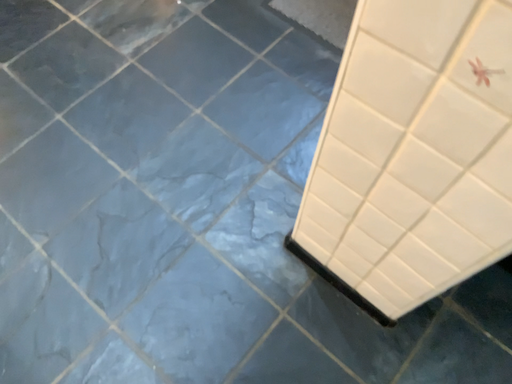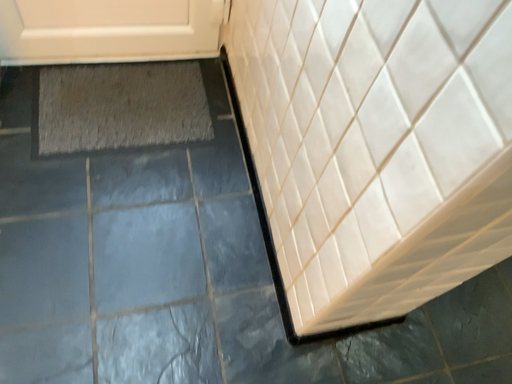
Question: Which way did the camera rotate in the video?

Choices:
 (A) rotated downward
 (B) rotated upward

Answer: (B)